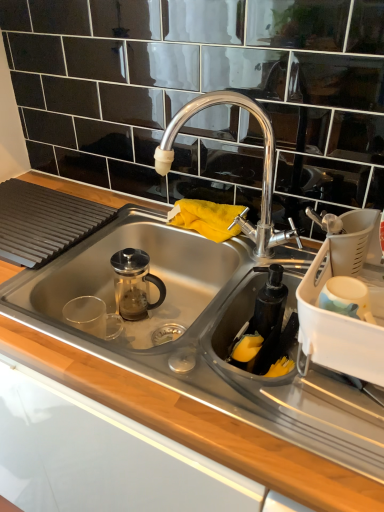
Question: Do you think white plastic dish rack at right, which is the first appliance in right-to-left order, is within stainless steel sink at center, or outside of it?

Choices:
 (A) inside
 (B) outside

Answer: (B)

Question: Does point (357, 229) appear closer or farther from the camera than point (210, 321)?

Choices:
 (A) closer
 (B) farther

Answer: (A)

Question: Estimate the real-world distances between objects in this image. Which object is closer to the black matte soap dispenser at lower right, the 1th appliance viewed from the left?

Choices:
 (A) polished chrome faucet at center
 (B) stainless steel sink at center
 (C) white plastic dish rack at right, which is the first appliance in right-to-left order

Answer: (C)

Question: Which object is the closest to the stainless steel sink at center?

Choices:
 (A) white plastic dish rack at right, which is the first appliance in right-to-left order
 (B) black matte soap dispenser at lower right, the 1th appliance viewed from the left
 (C) polished chrome faucet at center

Answer: (B)